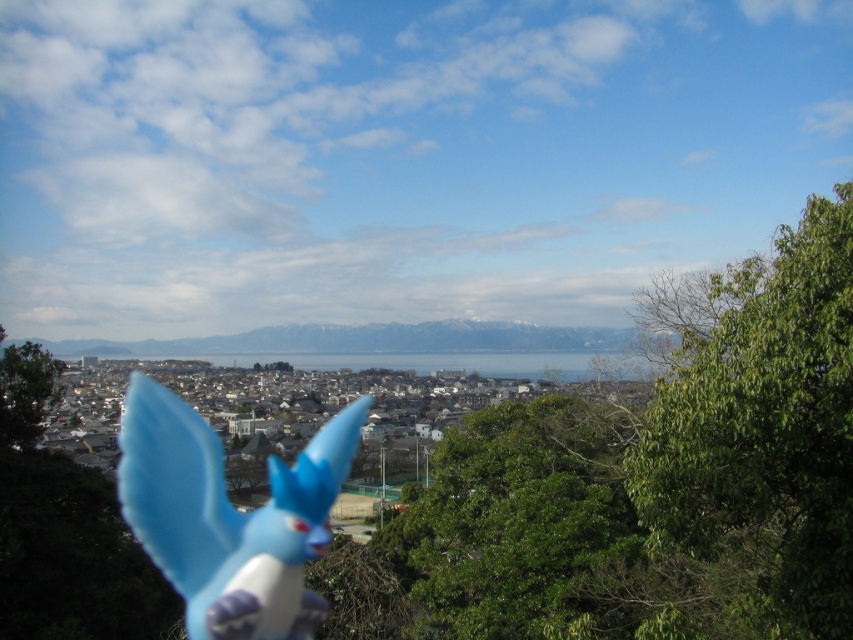
Question: Can you confirm if matte plastic toy at center is wider than green matte tree at lower left?

Choices:
 (A) yes
 (B) no

Answer: (A)

Question: Is green leafy tree at right bigger than matte plastic toy at center?

Choices:
 (A) yes
 (B) no

Answer: (B)

Question: Which object is the farthest from the green leafy tree at right?

Choices:
 (A) matte plastic toy at center
 (B) green matte tree at lower left

Answer: (B)

Question: Which object appears farthest from the camera in this image?

Choices:
 (A) matte plastic toy at center
 (B) green matte tree at lower left

Answer: (B)

Question: Can you confirm if matte plastic toy at center is wider than green matte tree at lower left?

Choices:
 (A) no
 (B) yes

Answer: (B)

Question: Which object is closer to the camera taking this photo?

Choices:
 (A) matte plastic toy at center
 (B) green leafy tree at right

Answer: (B)